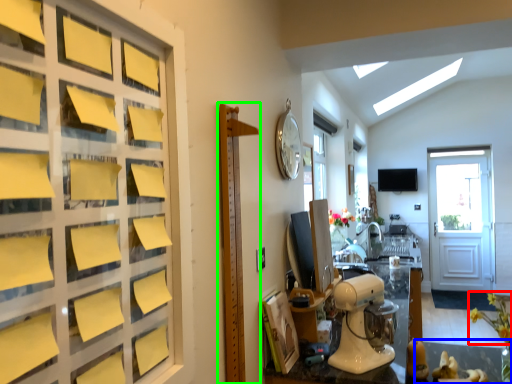
Question: Estimate the real-world distances between objects in this image. Which object is farther from flower (highlighted by a red box), glass table (highlighted by a blue box) or bulletin board (highlighted by a green box)?

Choices:
 (A) glass table
 (B) bulletin board

Answer: (B)